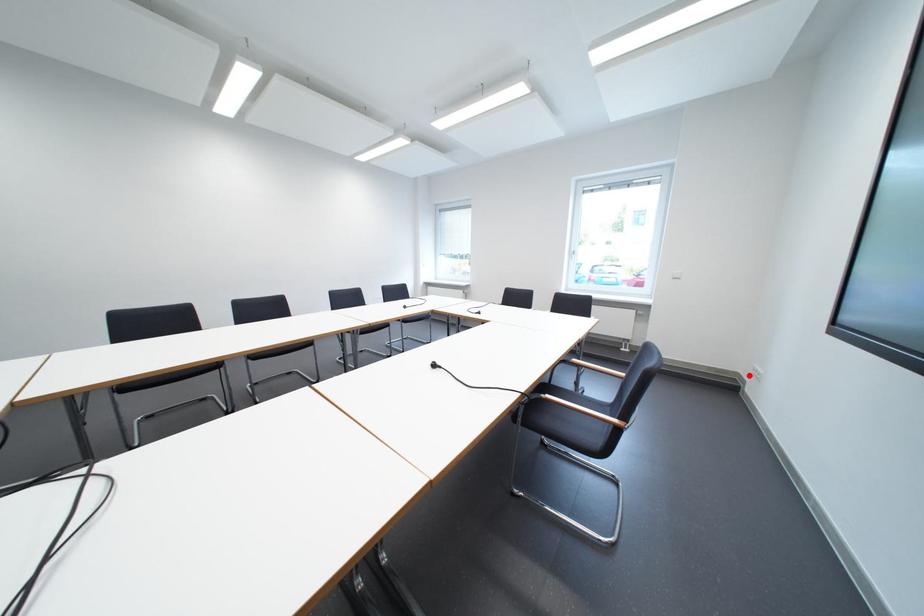
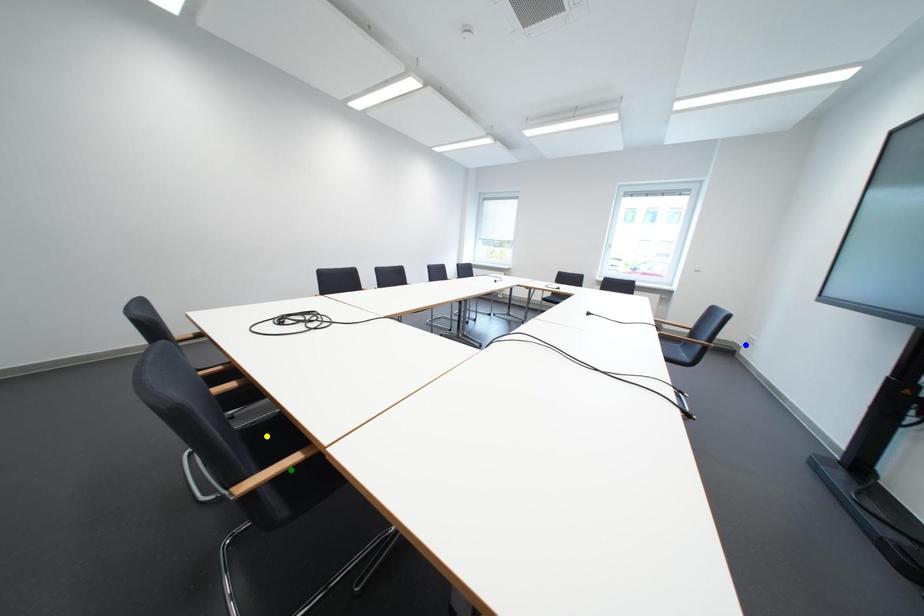
Question: I am providing you with two images of the same scene from different viewpoints. A red point is marked on the first image. You are given multiple points on the second image. Which mark in image 2 goes with the point in image 1?

Choices:
 (A) blue point
 (B) green point
 (C) yellow point

Answer: (A)